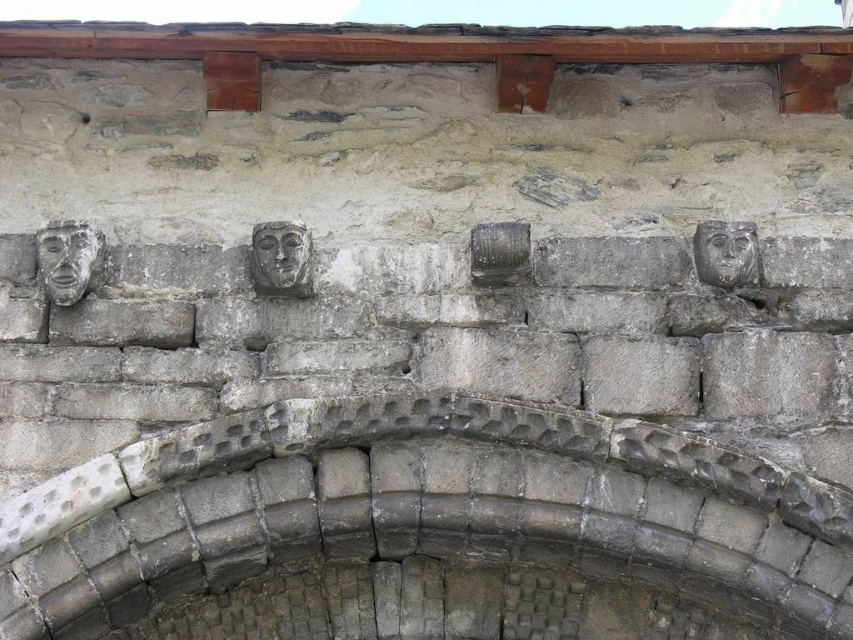
You are an architect examining the stone wall. You notice the gray stone arch at center and the gray stone face at center. Which of these two objects is bigger in size?

The gray stone arch at center is larger in size compared to the gray stone face at center.

You are an archaeologist examining a historical stone wall with two points marked on it. You need to determine which point is nearer to your current position. The points are labeled as point at (55, 253) and point at (305, 228). Which point is closer to you?

Point at (55, 253) is closer to the camera than point at (305, 228), so it is the closer point.

You are an architect examining the stone wall. You need to determine which of the two elements, the gray stone arch at center or the gray stone face at upper left, has a greater width. Based on the scene, which one is wider?

The gray stone arch at center has a greater width compared to the gray stone face at upper left, as stated in the description.